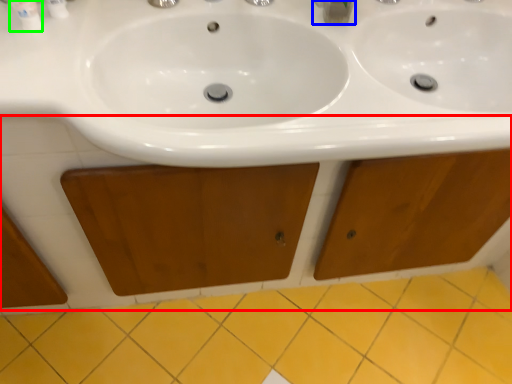
Question: Based on their relative distances, which object is nearer to cabinetry (highlighted by a red box)? Choose from plumbing fixture (highlighted by a blue box) and mouthwash (highlighted by a green box).

Choices:
 (A) plumbing fixture
 (B) mouthwash

Answer: (B)